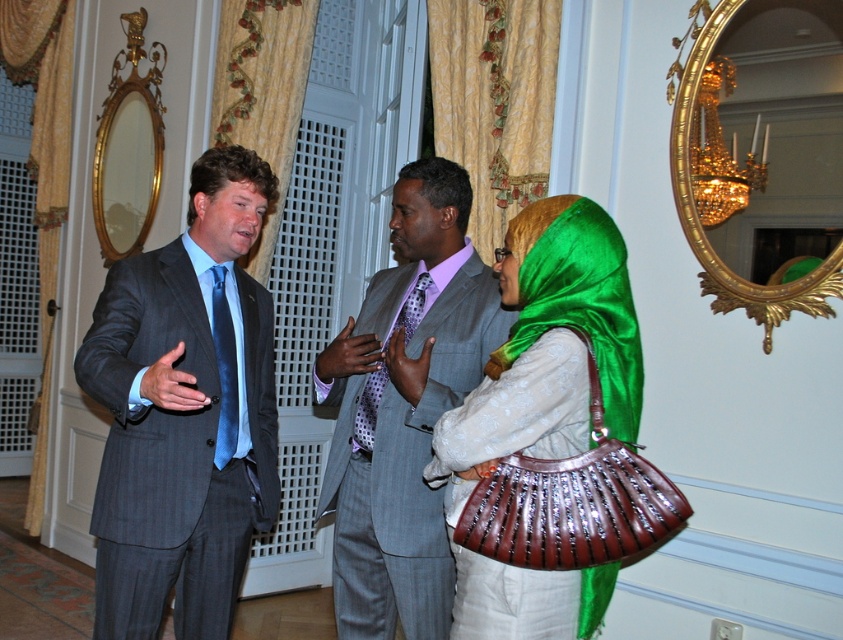
You are standing in the room and want to greet both the person in the gray pinstripe suit at center and the person wearing the shiny green fabric headscarf at center. Which one should you approach first based on their positions?

You should approach the gray pinstripe suit at center first because it is closer to you than the shiny green fabric headscarf at center, which is further away.

You are a photographer setting up for a group photo. You need to ensure that the dark gray pinstripe suit at center and the shiny green fabric headscarf at center are at least 30 inches apart to frame them properly. Based on the scene description, can you confirm if they are positioned correctly?

The dark gray pinstripe suit at center and the shiny green fabric headscarf at center are 32.79 inches apart from each other, which is more than the required 30 inches. Therefore, they are positioned correctly for the group photo.

What are the coordinates of the gray pinstripe suit at center?

The gray pinstripe suit at center is located at coordinates point (x=403, y=408).